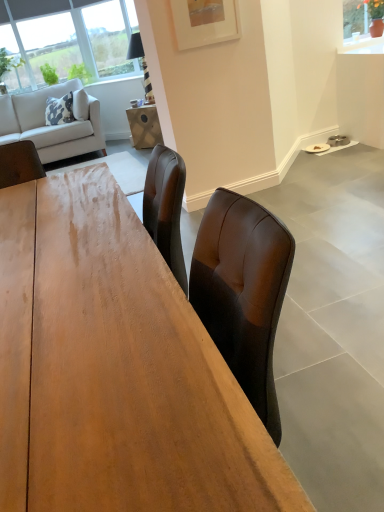
Question: From the image's perspective, is light gray fabric couch at upper left located beneath wooden table at center?

Choices:
 (A) no
 (B) yes

Answer: (A)

Question: From a real-world perspective, is light gray fabric couch at upper left on top of wooden table at center?

Choices:
 (A) no
 (B) yes

Answer: (B)

Question: Is light gray fabric couch at upper left wider than wooden table at center?

Choices:
 (A) no
 (B) yes

Answer: (A)

Question: Would you say light gray fabric couch at upper left is outside wooden table at center?

Choices:
 (A) no
 (B) yes

Answer: (B)

Question: Is wooden table at center completely or partially inside light gray fabric couch at upper left?

Choices:
 (A) yes
 (B) no

Answer: (B)

Question: In the image, is white glossy counter top at upper right positioned in front of or behind wooden table at center?

Choices:
 (A) front
 (B) behind

Answer: (B)

Question: From the image's perspective, relative to wooden table at center, is white glossy counter top at upper right above or below?

Choices:
 (A) below
 (B) above

Answer: (B)

Question: Looking at the image, does white glossy counter top at upper right seem bigger or smaller compared to wooden table at center?

Choices:
 (A) small
 (B) big

Answer: (A)

Question: From a real-world perspective, is white glossy counter top at upper right positioned above or below wooden table at center?

Choices:
 (A) above
 (B) below

Answer: (A)

Question: In the image, is wooden table at center on the left side or the right side of white matte picture frame at upper center?

Choices:
 (A) right
 (B) left

Answer: (B)

Question: Considering their positions, is wooden table at center located in front of or behind white matte picture frame at upper center?

Choices:
 (A) front
 (B) behind

Answer: (A)

Question: In terms of width, does wooden table at center look wider or thinner when compared to white matte picture frame at upper center?

Choices:
 (A) wide
 (B) thin

Answer: (A)

Question: From the image's perspective, relative to white matte picture frame at upper center, is wooden table at center above or below?

Choices:
 (A) above
 (B) below

Answer: (B)

Question: Looking at their shapes, would you say wooden table at center is wider or thinner than white glossy counter top at upper right?

Choices:
 (A) wide
 (B) thin

Answer: (A)

Question: From a real-world perspective, relative to white glossy counter top at upper right, is wooden table at center vertically above or below?

Choices:
 (A) above
 (B) below

Answer: (B)